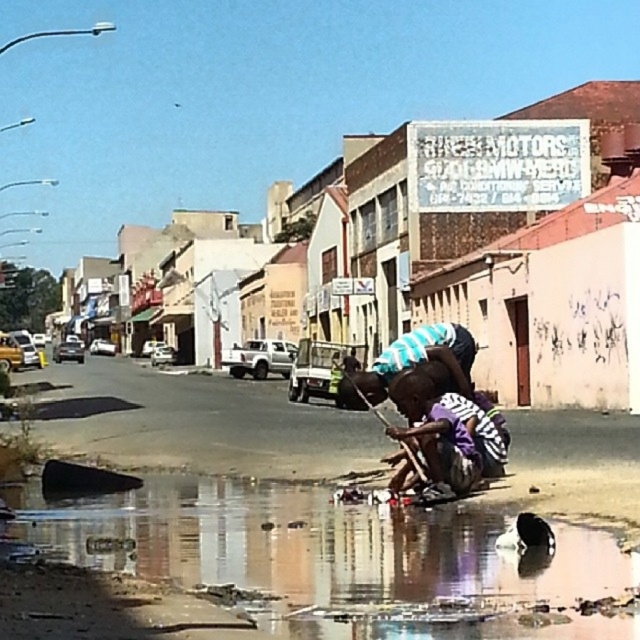
Which is behind, point (328, 563) or point (481, 465)?

Point (481, 465)

Describe the element at coordinates (316, 545) in the screenshot. I see `reflective wet sand at lower center` at that location.

Is point (172, 493) closer to viewer compared to point (401, 387)?

No, (172, 493) is further to viewer.

Locate an element on the screen. reflective wet sand at lower center is located at coordinates (316, 545).